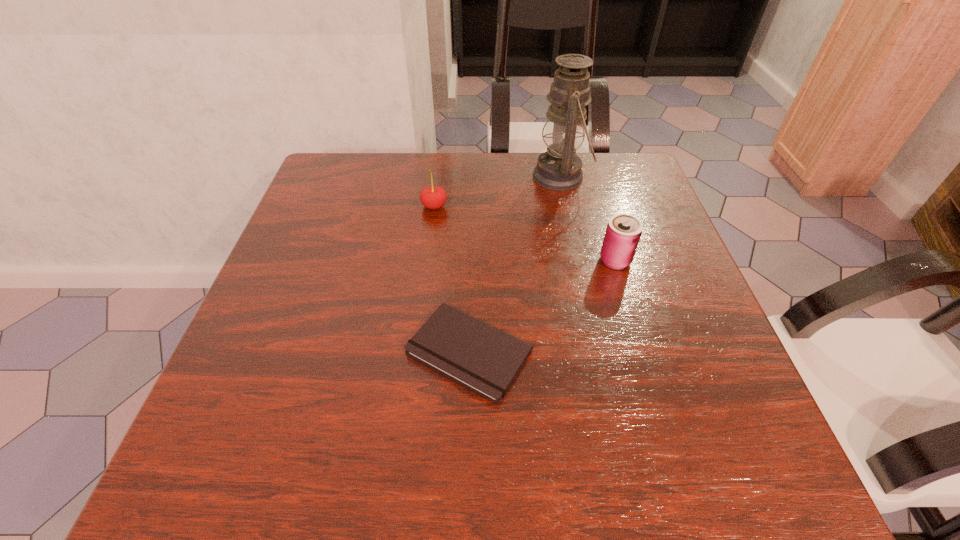
Locate an element on the screen. The image size is (960, 540). free space that is in between the nearest object and the tallest object is located at coordinates (515, 264).

This screenshot has width=960, height=540. Find the location of `vacant area that lies between the oil lamp and the checkbook`. vacant area that lies between the oil lamp and the checkbook is located at coordinates (515, 264).

Find the location of `empty location between the cherry and the second nearest object`. empty location between the cherry and the second nearest object is located at coordinates (525, 233).

Image resolution: width=960 pixels, height=540 pixels. I want to click on vacant space that's between the second nearest object and the checkbook, so (542, 306).

Find the location of a particular element. The image size is (960, 540). free space between the tallest object and the nearest object is located at coordinates (515, 264).

Where is `empty location between the oil lamp and the cherry`? empty location between the oil lamp and the cherry is located at coordinates (497, 191).

Find the location of a particular element. This screenshot has width=960, height=540. unoccupied position between the cherry and the can is located at coordinates (525, 233).

Locate an element on the screen. The width and height of the screenshot is (960, 540). blank region between the cherry and the second nearest object is located at coordinates (525, 233).

Where is `vacant space that's between the checkbook and the cherry`? Image resolution: width=960 pixels, height=540 pixels. vacant space that's between the checkbook and the cherry is located at coordinates (452, 279).

Locate an element on the screen. The width and height of the screenshot is (960, 540). object that is the third closest one to the cherry is located at coordinates (623, 232).